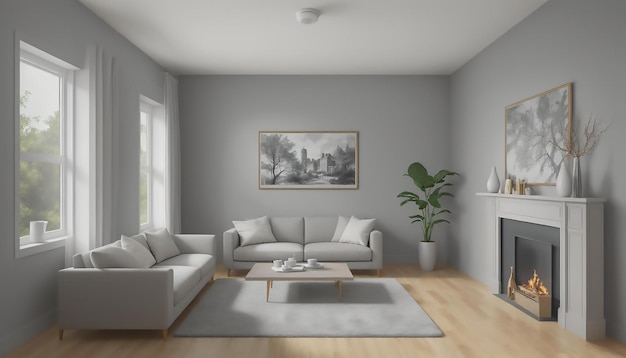
The image size is (626, 358). Identify the location of vase. (562, 183).